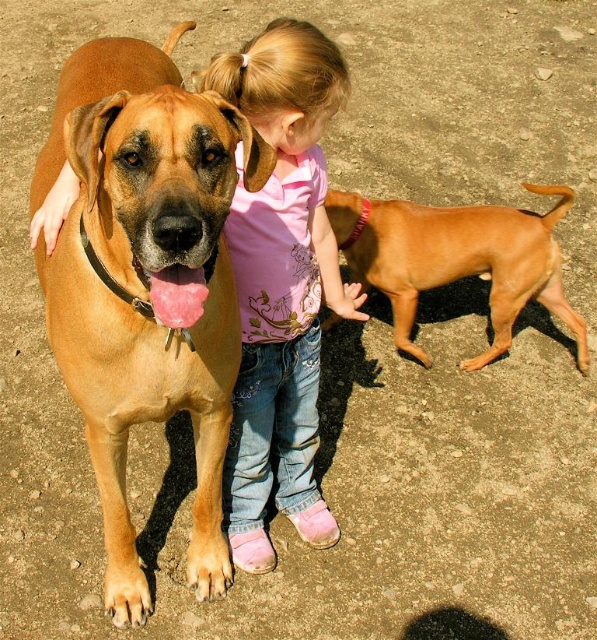
You are a photographer trying to capture a photo of both the matte brown dog at center and the smooth tan dog at center. Since you want to ensure both are in focus, you need to know which dog is closer to the camera. Can you determine which dog is nearer?

The matte brown dog at center is bigger than smooth tan dog at center, so the matte brown dog at center is closer to the camera because larger size in the image typically indicates closer proximity.

You are a photographer standing in front of the scene. You want to take a photo focusing on the pink cotton shirt at center. However, the matte brown dog at center is blocking your view. Can you move the dog to the side to get a clear shot of the shirt?

The matte brown dog at center is closer to the viewer than the pink cotton shirt at center, so moving the dog would allow you to get a clear shot of the shirt without obstruction.

You are a photographer trying to capture a candid shot of the girl and her dogs. You notice the pink cotton shirt at center and the smooth tan dog at center. Which object should you focus on first if you want to photograph the taller one?

The pink cotton shirt at center is taller than the smooth tan dog at center, so you should focus on the pink cotton shirt at center first.